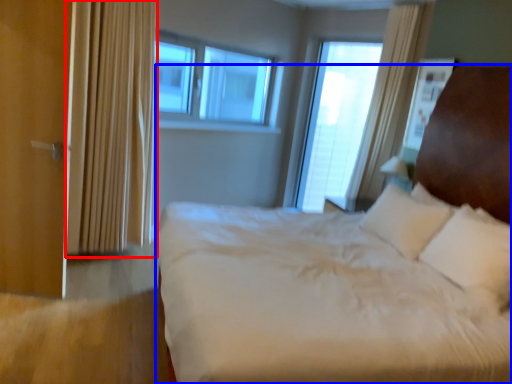
Question: Which object is further to the camera taking this photo, curtain (highlighted by a red box) or bed (highlighted by a blue box)?

Choices:
 (A) curtain
 (B) bed

Answer: (A)